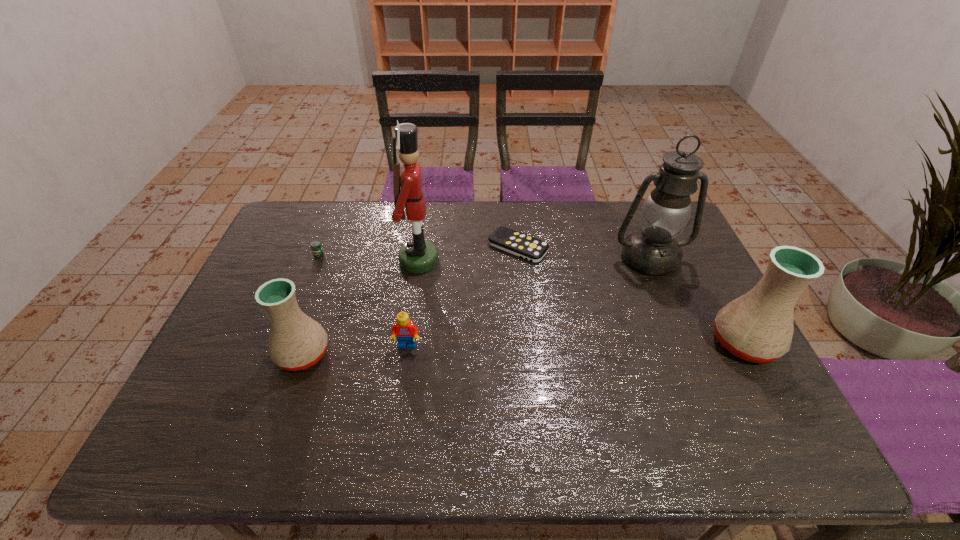
If the aim is uniform spacing by inserting an additional pottery among them, please point to a vacant space for this new pottery. Please provide its 2D coordinates. Your answer should be formatted as a tuple, i.e. [(x, y)], where the tuple contains the x and y coordinates of a point satisfying the conditions above.

[(526, 348)]